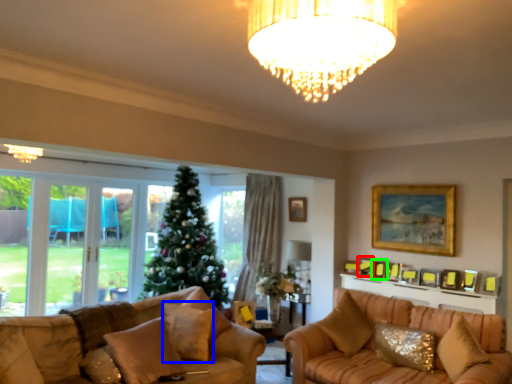
Question: Based on their relative distances, which object is farther from picture frame (highlighted by a red box)? Choose from pillow (highlighted by a blue box) and picture frame (highlighted by a green box).

Choices:
 (A) pillow
 (B) picture frame

Answer: (A)